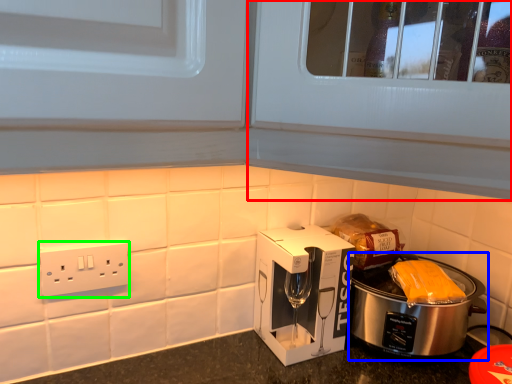
Question: Which is farther away from glass door (highlighted by a red box)? slow cooker (highlighted by a blue box) or power plugs and sockets (highlighted by a green box)?

Choices:
 (A) slow cooker
 (B) power plugs and sockets

Answer: (B)